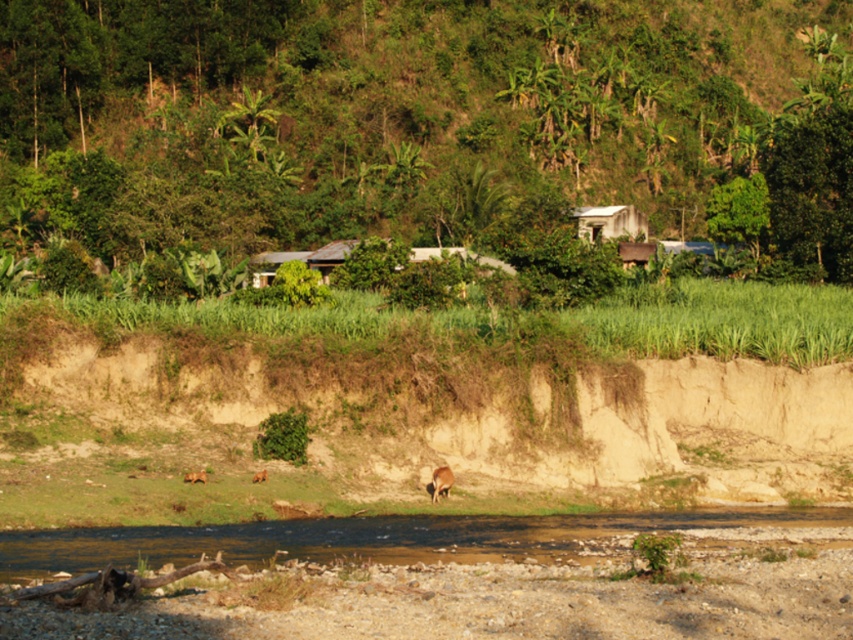
You are planning to cross the brown gravel river at lower center using a wooden plank that is as wide as the white corrugated metal hut at upper center. Will the plank be wide enough to safely cross the river?

The brown gravel river at lower center is wider than the white corrugated metal hut at upper center, so the wooden plank, which is as wide as the hut, will not be wide enough to safely cross the river.

Consider the image. You are a photographer planning to capture the white corrugated metal hut at upper center and the brown furry dog at lower center in a single frame. Based on their sizes in the image, which object would appear larger in your photo?

The brown furry dog at lower center would appear larger in the photo since the white corrugated metal hut at upper center is smaller than it.

You are standing at the origin point of the coordinate system in this scene. The white corrugated metal hut at upper center is marked at a specific coordinate. Can you determine its exact location based on the given coordinates?

The white corrugated metal hut at upper center is located at point (608, 221).